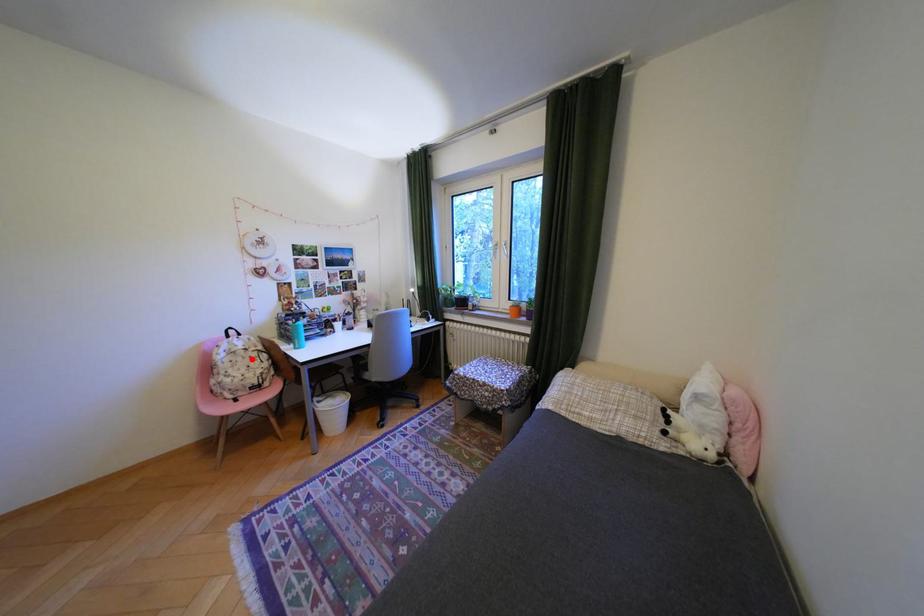
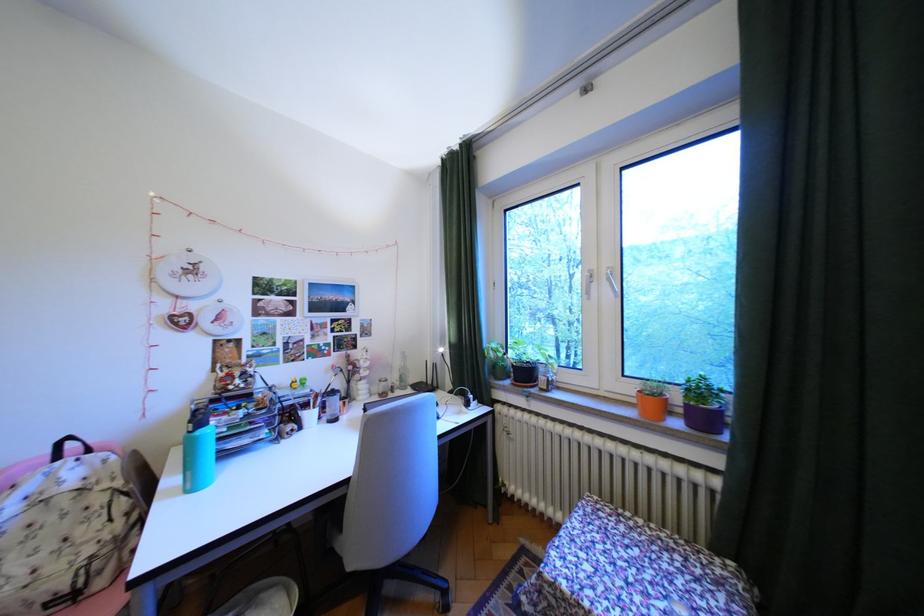
Find the pixel in the second image that matches the highlighted location in the first image.

(65, 519)